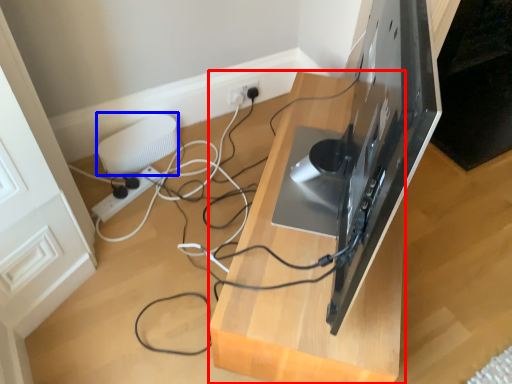
Question: Which object is further to the camera taking this photo, furniture (highlighted by a red box) or appliance (highlighted by a blue box)?

Choices:
 (A) furniture
 (B) appliance

Answer: (B)